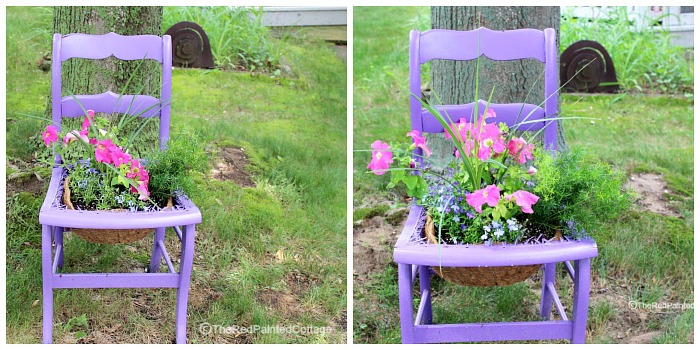
Where is `gray wall`? gray wall is located at coordinates (290, 9).